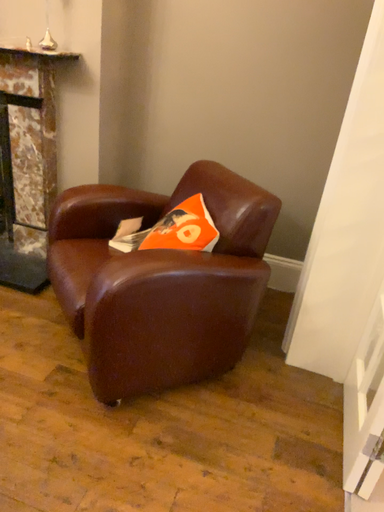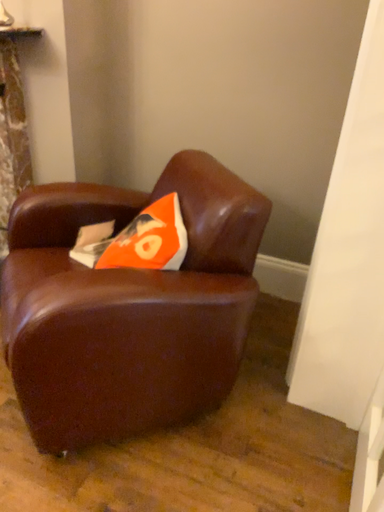
Question: How did the camera likely rotate when shooting the video?

Choices:
 (A) rotated right
 (B) rotated left

Answer: (B)